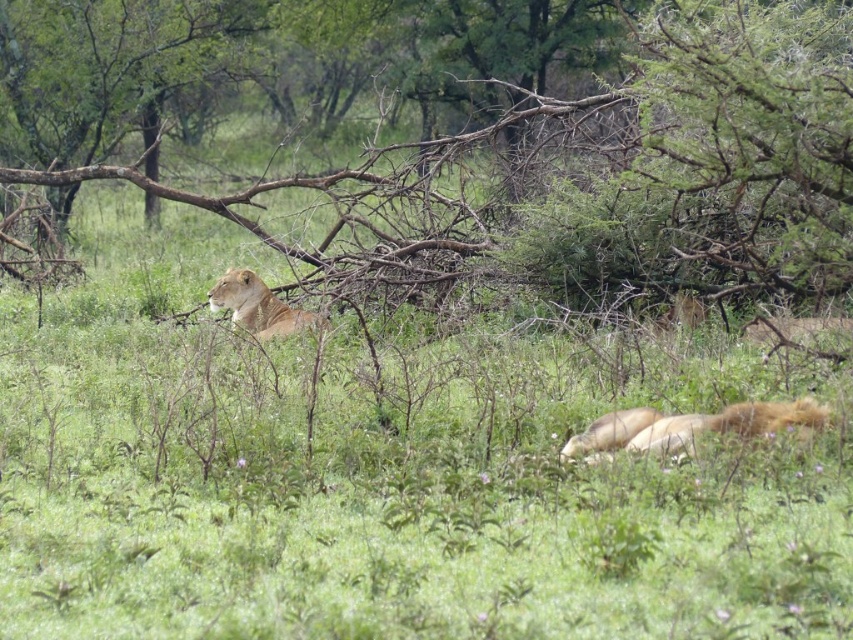
Which is below, brown wood tree at upper center or golden fur lion at lower right?

Result: Positioned lower is golden fur lion at lower right.

Image resolution: width=853 pixels, height=640 pixels. I want to click on brown wood tree at upper center, so click(x=633, y=164).

In order to click on brown wood tree at upper center in this screenshot , I will do tap(633, 164).

Is point (351, 257) positioned in front of point (253, 323)?

No, it is behind (253, 323).

Is point (631, 33) behind point (262, 330)?

Yes, it is.

Locate an element on the screen. brown wood tree at upper center is located at coordinates (633, 164).

Is golden fur lion at lower right to the left of golden fur lioness at upper left from the viewer's perspective?

Incorrect, golden fur lion at lower right is not on the left side of golden fur lioness at upper left.

The width and height of the screenshot is (853, 640). What are the coordinates of `golden fur lion at lower right` in the screenshot? It's located at (689, 426).